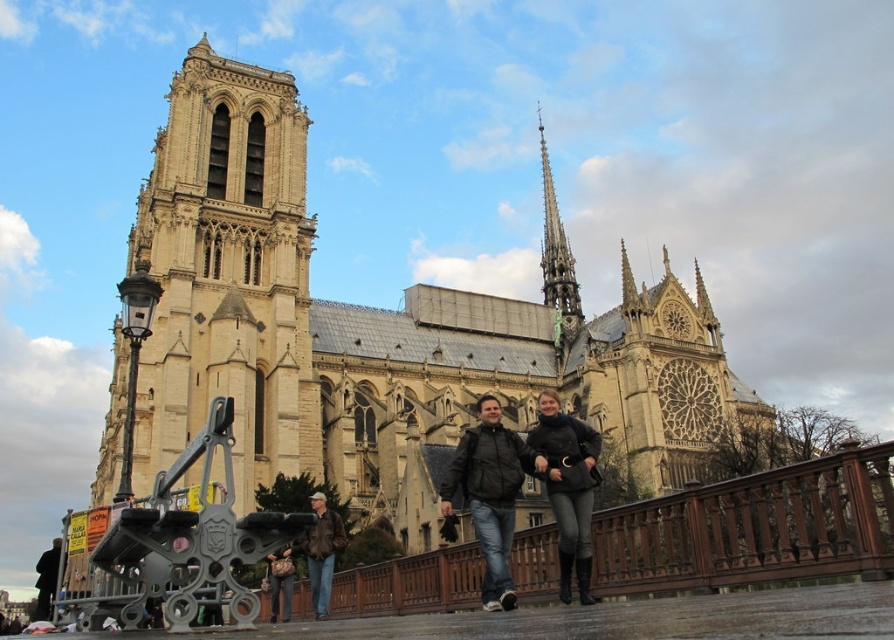
Does beige stone tower at left have a smaller size compared to smooth stone spire at upper center?

No, beige stone tower at left is not smaller than smooth stone spire at upper center.

Where is `beige stone tower at left`? This screenshot has width=894, height=640. beige stone tower at left is located at coordinates (226, 273).

Identify the location of beige stone tower at left. This screenshot has height=640, width=894. (226, 273).

Which is behind, point (862, 467) or point (482, 534)?

The point (482, 534) is more distant.

Which is above, brown wooden rail at center or dark brown leather jacket at center?

Positioned higher is dark brown leather jacket at center.

Between point (529, 589) and point (564, 554), which one is positioned behind?

The point (529, 589) is behind.

At what (x,y) coordinates should I click in order to perform the action: click on brown wooden rail at center. Please return your answer as a coordinate pair (x, y). Looking at the image, I should click on (753, 529).

From the picture: How far apart are beige stone tower at left and dark brown leather jacket at center?

beige stone tower at left is 30.79 meters away from dark brown leather jacket at center.

Is beige stone tower at left thinner than dark brown leather jacket at center?

Incorrect, beige stone tower at left's width is not less than dark brown leather jacket at center's.

At what (x,y) coordinates should I click in order to perform the action: click on beige stone tower at left. Please return your answer as a coordinate pair (x, y). Looking at the image, I should click on (226, 273).